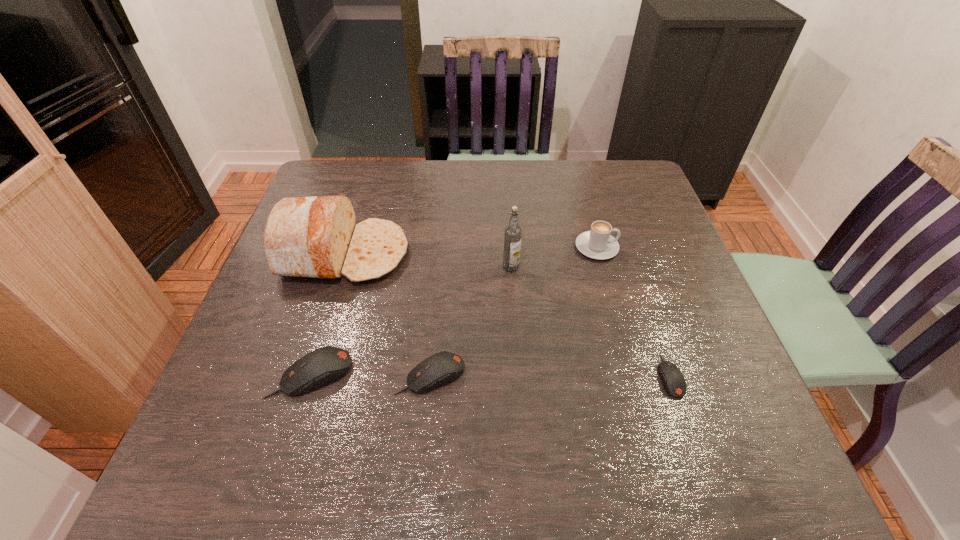
This screenshot has width=960, height=540. Identify the location of free space that satisfies the following two spatial constraints: 1. to the right of the cappuccino; 2. on the label of the third object from right to left. (602, 267).

At what (x,y) coordinates should I click in order to perform the action: click on vacant area in the image that satisfies the following two spatial constraints: 1. to the right of the fourth shortest object; 2. on the left side of the shortest computer mouse. Please return your answer as a coordinate pair (x, y). This screenshot has width=960, height=540. Looking at the image, I should click on (632, 376).

What are the coordinates of `blank area in the image that satisfies the following two spatial constraints: 1. at the sliced end of the rightmost computer mouse; 2. on the right side of the bread` in the screenshot? It's located at (306, 376).

Find the location of a particular element. This screenshot has width=960, height=540. free location that satisfies the following two spatial constraints: 1. at the sliced end of the shortest object; 2. on the left side of the bread is located at coordinates (306, 376).

Locate an element on the screen. Image resolution: width=960 pixels, height=540 pixels. free space that satisfies the following two spatial constraints: 1. to the right of the fourth shortest object; 2. on the front side of the fifth tallest object is located at coordinates (632, 375).

In order to click on vacant point that satisfies the following two spatial constraints: 1. on the front side of the rightmost computer mouse; 2. on the left side of the leftmost computer mouse in this screenshot , I will do `click(311, 376)`.

You are a GUI agent. You are given a task and a screenshot of the screen. Output one action in this format:
    pyautogui.click(x=<x>, y=<y>)
    Task: Click on the free spot that satisfies the following two spatial constraints: 1. on the label of the vodka; 2. on the left side of the rightmost computer mouse
    This screenshot has height=540, width=960.
    Given the screenshot: What is the action you would take?
    pyautogui.click(x=518, y=376)